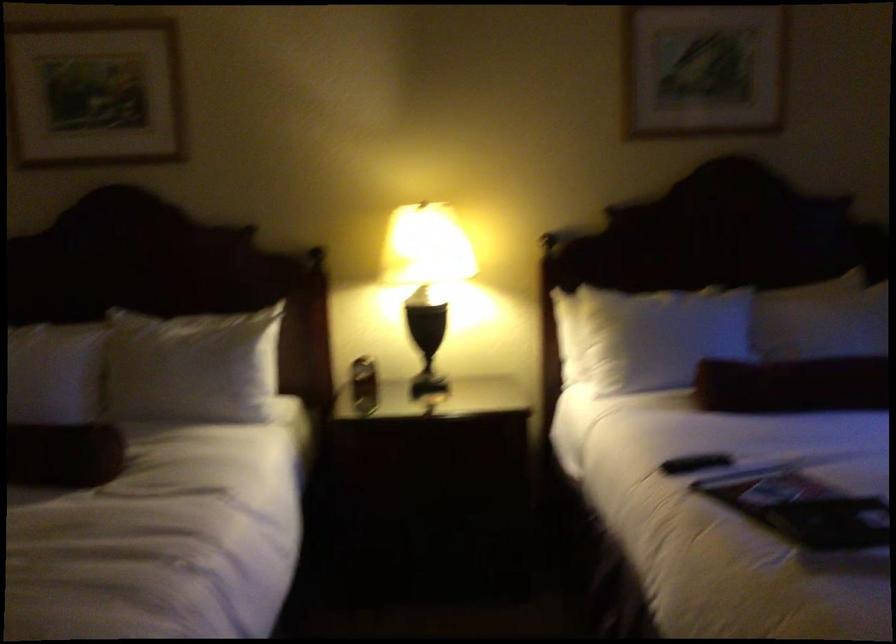
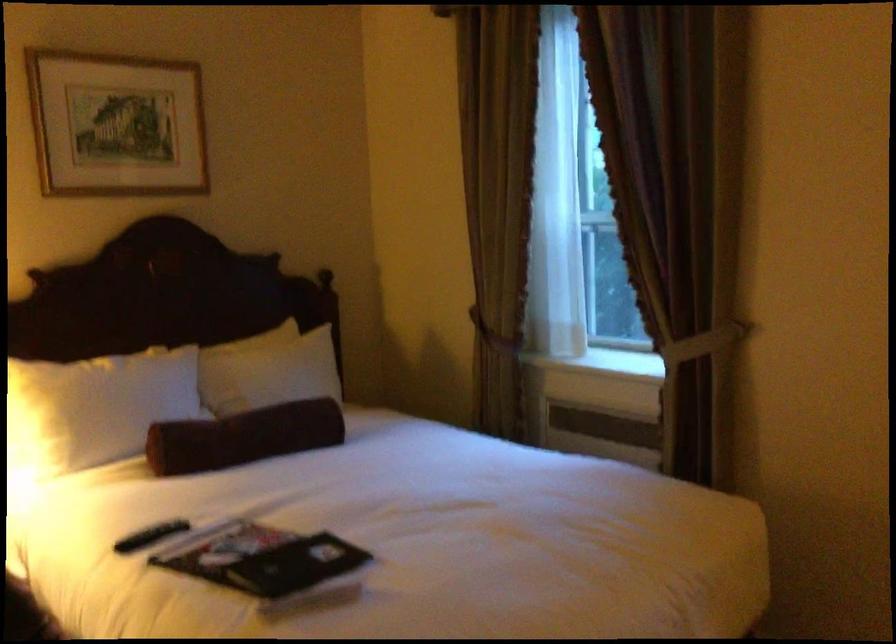
Question: The first image is from the beginning of the video and the second image is from the end. How did the camera likely rotate when shooting the video?

Choices:
 (A) Left
 (B) Right
 (C) Up
 (D) Down

Answer: (B)